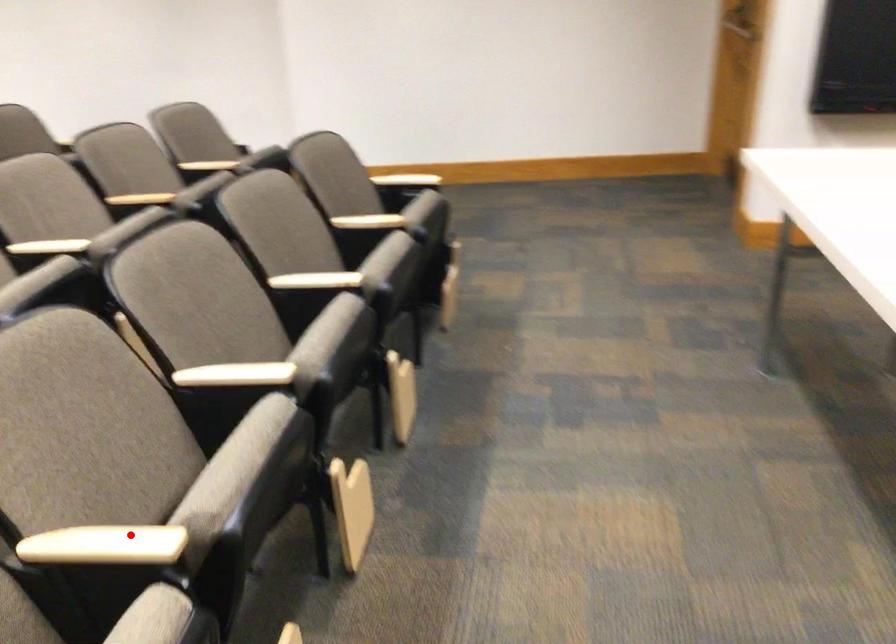
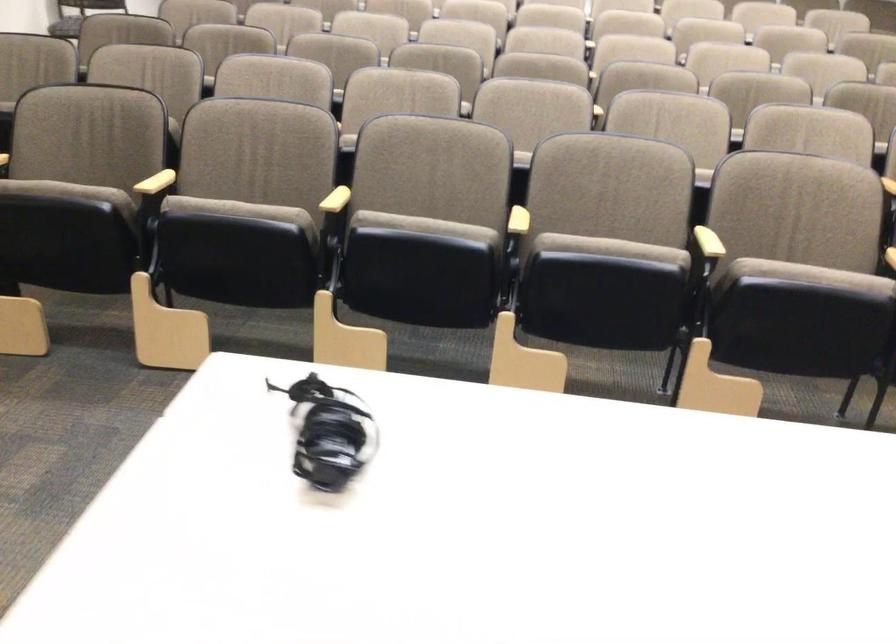
Question: I am providing you with two images of the same scene from different viewpoints. A red point is shown in image1. For the corresponding object point in image2, is it positioned nearer or farther from the camera?

Choices:
 (A) Nearer
 (B) Farther

Answer: (B)